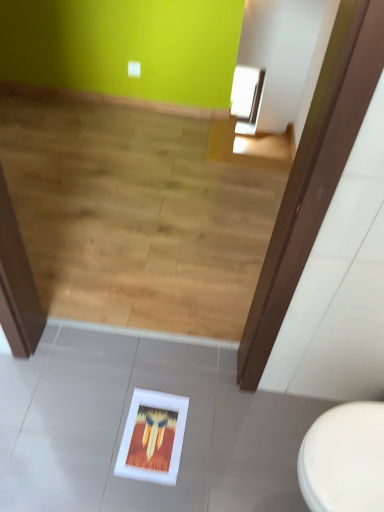
Question: Does point pos(187,248) appear closer or farther from the camera than point pos(319,466)?

Choices:
 (A) closer
 (B) farther

Answer: (B)

Question: Is wooden floor at lower center situated inside white glossy toilet at lower right or outside?

Choices:
 (A) inside
 (B) outside

Answer: (B)

Question: Which object is the farthest from the white matte picture frame at lower center?

Choices:
 (A) wooden floor at lower center
 (B) white glossy toilet at lower right

Answer: (A)

Question: Which is nearer to the white glossy toilet at lower right?

Choices:
 (A) white matte picture frame at lower center
 (B) wooden floor at lower center

Answer: (A)